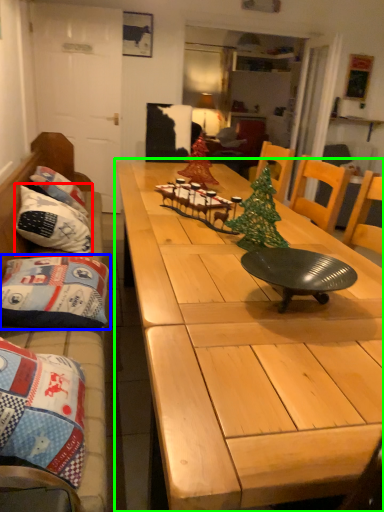
Question: Which object is the closest to the pillow (highlighted by a red box)? Choose among these: pillow (highlighted by a blue box) or table (highlighted by a green box).

Choices:
 (A) pillow
 (B) table

Answer: (A)